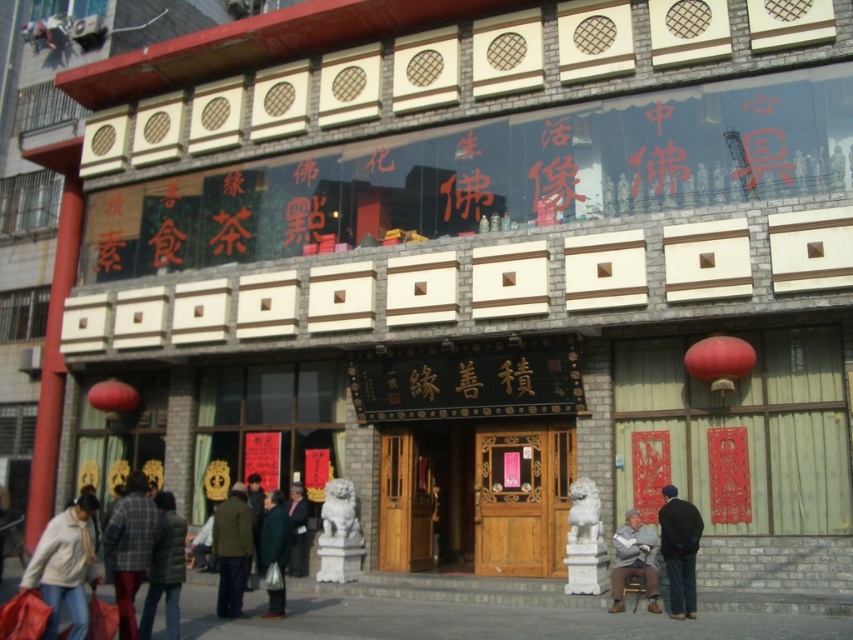
You are standing in front of the traditional building and want to enter through the entrance. Where exactly is the wooden door at center located on the facade?

The wooden door at center is located at point 0.783 on the horizontal axis and 0.613 on the vertical axis of the facade.

You are standing in front of the traditional building. There is a wooden door at center marked by point (x=521, y=500). Where is the wooden door at center located relative to the rectangular windows with circular grilles?

The wooden door at center is located below the rectangular windows with circular grilles, as the point (x=521, y=500) is positioned lower than the windows.